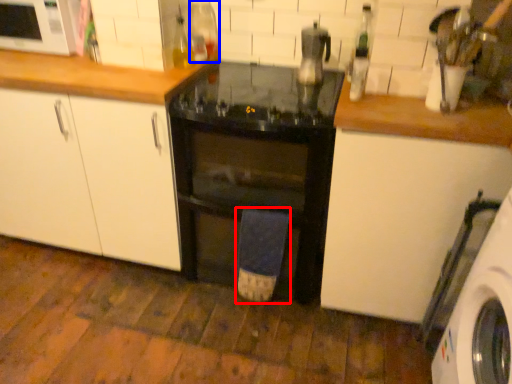
Question: Which point is closer to the camera, bath towel (highlighted by a red box) or bottle (highlighted by a blue box)?

Choices:
 (A) bath towel
 (B) bottle

Answer: (A)